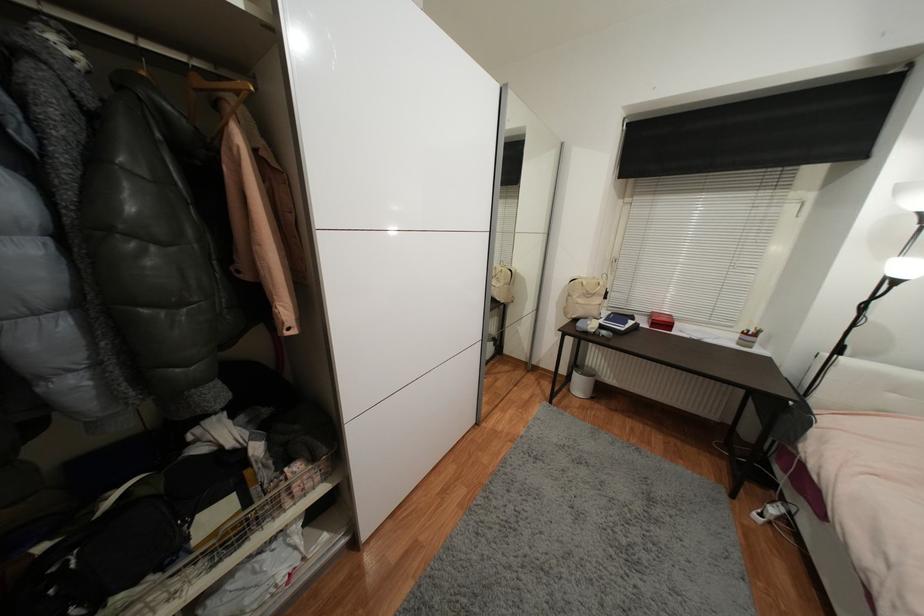
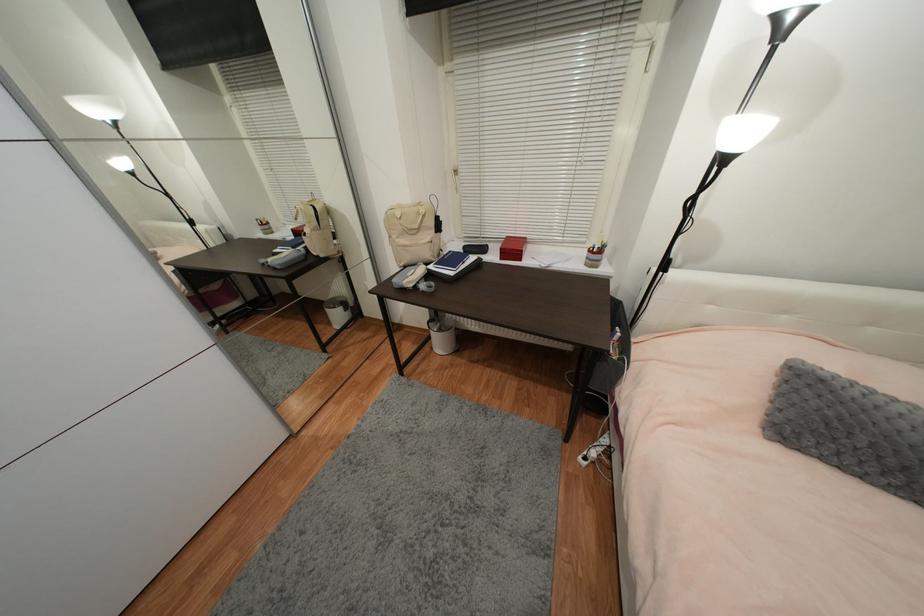
What movement of the cameraman would produce the second image?

The cameraman walked toward right, forward.